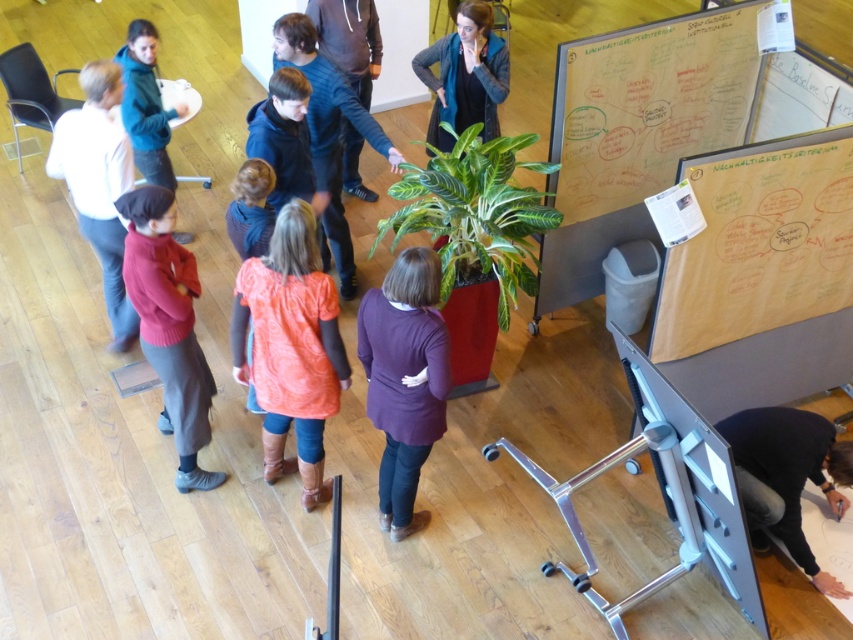
Question: Is dark blue hoodie at center above matte black hoodie at upper left?

Choices:
 (A) no
 (B) yes

Answer: (B)

Question: Among these points, which one is farthest from the camera?

Choices:
 (A) (341, 125)
 (B) (502, 276)

Answer: (A)

Question: Observing the image, what is the correct spatial positioning of orange textured sweater at center in reference to dark blue sweater at center?

Choices:
 (A) below
 (B) above

Answer: (A)

Question: Is orange textured sweater at center thinner than matte red sweater at center?

Choices:
 (A) yes
 (B) no

Answer: (B)

Question: Which object is farther from the camera taking this photo?

Choices:
 (A) black fabric at lower right
 (B) green glossy plant at center
 (C) white cotton shirt at left
 (D) purple soft sweater at center

Answer: (C)

Question: Which is farther from the orange textured sweater at center?

Choices:
 (A) wooden/rough bulletin board at upper right
 (B) dark gray sweater at center
 (C) black fabric at lower right

Answer: (C)